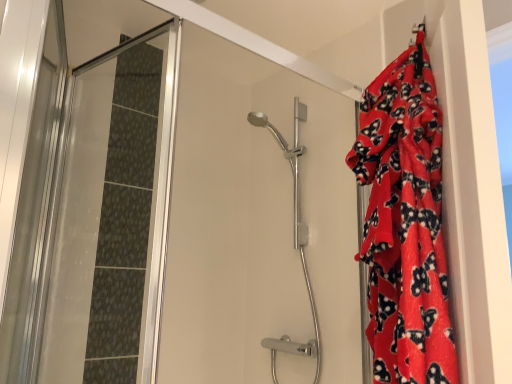
Measure the distance between point (285, 149) and camera.

The distance of point (285, 149) from camera is 1.91 meters.

Image resolution: width=512 pixels, height=384 pixels. What do you see at coordinates (405, 223) in the screenshot?
I see `red fleece blanket at right` at bounding box center [405, 223].

Where is `polished chrome shower head at center`? Image resolution: width=512 pixels, height=384 pixels. polished chrome shower head at center is located at coordinates (294, 241).

Can you confirm if red fleece blanket at right is shorter than polished chrome shower head at center?

Yes.

Which of these two, red fleece blanket at right or polished chrome shower head at center, is thinner?

red fleece blanket at right.

Image resolution: width=512 pixels, height=384 pixels. Identify the location of blanket above the polished chrome shower head at center (from the image's perspective). (405, 223).

Is red fleece blanket at right turned away from polished chrome shower head at center?

No.

Which of these two, polished chrome shower head at center or transparent glass shower door at left, is thinner?

polished chrome shower head at center is thinner.

How much distance is there between polished chrome shower head at center and transparent glass shower door at left?

polished chrome shower head at center and transparent glass shower door at left are 29.60 inches apart.

Is polished chrome shower head at center to the right of transparent glass shower door at left from the viewer's perspective?

Yes, polished chrome shower head at center is to the right of transparent glass shower door at left.

Considering the sizes of objects red fleece blanket at right and transparent glass shower door at left in the image provided, who is wider, red fleece blanket at right or transparent glass shower door at left?

transparent glass shower door at left.

Measure the distance between red fleece blanket at right and transparent glass shower door at left.

A distance of 38.36 inches exists between red fleece blanket at right and transparent glass shower door at left.

Image resolution: width=512 pixels, height=384 pixels. I want to click on blanket that appears above the transparent glass shower door at left (from a real-world perspective), so click(405, 223).

Considering the points (429, 82) and (129, 333), which point is in front, point (429, 82) or point (129, 333)?

Point (429, 82)

From a real-world perspective, is transparent glass shower door at left positioned above or below red fleece blanket at right?

Clearly, from a real-world perspective, transparent glass shower door at left is below red fleece blanket at right.

Based on their sizes in the image, would you say transparent glass shower door at left is bigger or smaller than red fleece blanket at right?

In the image, transparent glass shower door at left appears to be smaller than red fleece blanket at right.

Does transparent glass shower door at left have a lesser width compared to red fleece blanket at right?

No, transparent glass shower door at left is not thinner than red fleece blanket at right.

In the image, is polished chrome shower head at center on the left side or the right side of red fleece blanket at right?

polished chrome shower head at center is positioned on red fleece blanket at right's left side.

Is polished chrome shower head at center inside the boundaries of red fleece blanket at right, or outside?

polished chrome shower head at center is not inside red fleece blanket at right, it's outside.

From the image's perspective, is polished chrome shower head at center on red fleece blanket at right?

No.

Where is `shower door above the red fleece blanket at right (from a real-world perspective)`? Image resolution: width=512 pixels, height=384 pixels. shower door above the red fleece blanket at right (from a real-world perspective) is located at coordinates (294, 241).

From the image's perspective, would you say transparent glass shower door at left is shown under polished chrome shower head at center?

No, from the image's perspective, transparent glass shower door at left is not beneath polished chrome shower head at center.

In the scene shown: What's the angular difference between transparent glass shower door at left and polished chrome shower head at center's facing directions?

They differ by 102 degrees in their facing directions.

Considering the relative sizes of transparent glass shower door at left and polished chrome shower head at center in the image provided, is transparent glass shower door at left thinner than polished chrome shower head at center?

Incorrect, the width of transparent glass shower door at left is not less than that of polished chrome shower head at center.

Is transparent glass shower door at left to the right of polished chrome shower head at center from the viewer's perspective?

No.

Where is `shower door behind the red fleece blanket at right`? The image size is (512, 384). shower door behind the red fleece blanket at right is located at coordinates (294, 241).

I want to click on screen door below the polished chrome shower head at center (from a real-world perspective), so click(89, 218).

From the image, which object appears to be nearer to red fleece blanket at right, transparent glass shower door at left or polished chrome shower head at center?

Based on the image, polished chrome shower head at center appears to be nearer to red fleece blanket at right.

Looking at the image, which one is located further to polished chrome shower head at center, transparent glass shower door at left or red fleece blanket at right?

red fleece blanket at right.

Estimate the real-world distances between objects in this image. Which object is closer to red fleece blanket at right, polished chrome shower head at center or transparent glass shower door at left?

polished chrome shower head at center is positioned closer to the anchor red fleece blanket at right.

When comparing their distances from transparent glass shower door at left, does red fleece blanket at right or polished chrome shower head at center seem further?

red fleece blanket at right lies further to transparent glass shower door at left than the other object.

Which object lies further to the anchor point polished chrome shower head at center, red fleece blanket at right or transparent glass shower door at left?

Based on the image, red fleece blanket at right appears to be further to polished chrome shower head at center.

Estimate the real-world distances between objects in this image. Which object is further from transparent glass shower door at left, polished chrome shower head at center or red fleece blanket at right?

red fleece blanket at right is further to transparent glass shower door at left.

At what (x,y) coordinates should I click in order to perform the action: click on shower door located between transparent glass shower door at left and red fleece blanket at right in the left-right direction. Please return your answer as a coordinate pair (x, y). Image resolution: width=512 pixels, height=384 pixels. Looking at the image, I should click on (294, 241).